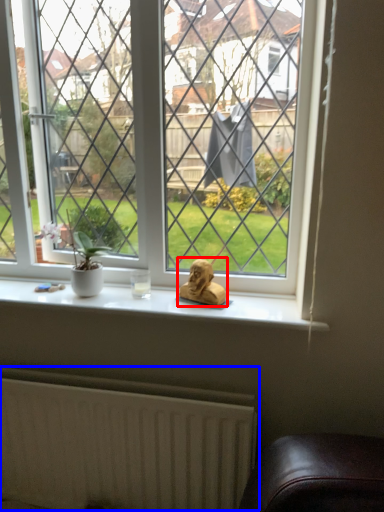
Question: Which object appears farthest to the camera in this image, animal (highlighted by a red box) or radiator (highlighted by a blue box)?

Choices:
 (A) animal
 (B) radiator

Answer: (A)